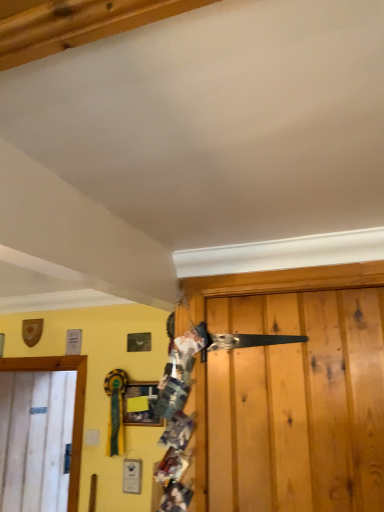
You are a GUI agent. You are given a task and a screenshot of the screen. Output one action in this format:
    pyautogui.click(x=<x>, y=<y>)
    Task: Click on the matte wooden picture frame at center
    The image size is (384, 512).
    Given the screenshot: What is the action you would take?
    pyautogui.click(x=140, y=408)

Measure the distance between point (78, 451) and camera.

Point (78, 451) and camera are 8.10 feet apart from each other.

Where is `white wood door at left`? This screenshot has height=512, width=384. white wood door at left is located at coordinates coord(75,405).

Locate an element on the screen. This screenshot has width=384, height=512. matte wooden picture frame at center is located at coordinates (140, 408).

Does white wood door at left contain multicolored fabric at center?

No, white wood door at left does not contain multicolored fabric at center.

Is white wood door at left oriented towards multicolored fabric at center?

Yes, white wood door at left is facing multicolored fabric at center.

Are white wood door at left and multicolored fabric at center making contact?

No, white wood door at left is not next to multicolored fabric at center.

Based on the photo, who is bigger, white wood door at left or multicolored fabric at center?

With larger size is white wood door at left.

Between multicolored fabric at center and white wood door at left, which one has larger width?

With larger width is multicolored fabric at center.

Considering the points (168, 477) and (71, 494), which point is in front, point (168, 477) or point (71, 494)?

The point (168, 477) is closer.

Considering their positions, is multicolored fabric at center located in front of or behind white wood door at left?

Visually, multicolored fabric at center is located in front of white wood door at left.

Considering the sizes of objects multicolored fabric at center and white wood door at left in the image provided, who is smaller, multicolored fabric at center or white wood door at left?

With smaller size is multicolored fabric at center.

Considering the sizes of objects multicolored fabric at center and matte wooden picture frame at center in the image provided, who is shorter, multicolored fabric at center or matte wooden picture frame at center?

matte wooden picture frame at center.

Is multicolored fabric at center spatially inside matte wooden picture frame at center, or outside of it?

multicolored fabric at center is not inside matte wooden picture frame at center, it's outside.

From the image's perspective, is multicolored fabric at center located beneath matte wooden picture frame at center?

No.

From the picture: Which of these two, multicolored fabric at center or matte wooden picture frame at center, is smaller?

With smaller size is matte wooden picture frame at center.

Which of these two, white wood door at left or matte wooden picture frame at center, is bigger?

white wood door at left.

Is white wood door at left oriented towards matte wooden picture frame at center?

Yes, white wood door at left is oriented towards matte wooden picture frame at center.

Is white wood door at left next to matte wooden picture frame at center?

No, white wood door at left is not in contact with matte wooden picture frame at center.

Is point (21, 364) closer or farther from the camera than point (127, 391)?

Clearly, point (21, 364) is more distant from the camera than point (127, 391).

Between matte wooden picture frame at center and white wood door at left, which one has smaller size?

Smaller between the two is matte wooden picture frame at center.

Identify the location of picture frame on the right of the white wood door at left. (140, 408).

From the image's perspective, who appears lower, matte wooden picture frame at center or white wood door at left?

white wood door at left, from the image's perspective.

From the picture: Is matte wooden picture frame at center turned away from multicolored fabric at center?

No, matte wooden picture frame at center's orientation is not away from multicolored fabric at center.

Is matte wooden picture frame at center outside of multicolored fabric at center?

Indeed, matte wooden picture frame at center is completely outside multicolored fabric at center.

Identify the location of picture frame lying below the multicolored fabric at center (from the image's perspective). (140, 408).

You are a GUI agent. You are given a task and a screenshot of the screen. Output one action in this format:
    pyautogui.click(x=<x>, y=<y>)
    Task: Click on the person above the white wood door at left (from a real-world perspective)
    This screenshot has height=512, width=384.
    Given the screenshot: What is the action you would take?
    pyautogui.click(x=177, y=414)

Where is `person that appears on the right of white wood door at left`? The width and height of the screenshot is (384, 512). person that appears on the right of white wood door at left is located at coordinates (177, 414).

From the image, which object appears to be farther from multicolored fabric at center, matte wooden picture frame at center or white wood door at left?

white wood door at left is further to multicolored fabric at center.

Which object lies further to the anchor point multicolored fabric at center, white wood door at left or matte wooden picture frame at center?

white wood door at left is positioned further to the anchor multicolored fabric at center.

When comparing their distances from matte wooden picture frame at center, does multicolored fabric at center or white wood door at left seem closer?

Among the two, white wood door at left is located nearer to matte wooden picture frame at center.

From the picture: Based on their spatial positions, is matte wooden picture frame at center or multicolored fabric at center closer to white wood door at left?

matte wooden picture frame at center is closer to white wood door at left.

When comparing their distances from white wood door at left, does multicolored fabric at center or matte wooden picture frame at center seem closer?

matte wooden picture frame at center is closer to white wood door at left.

Estimate the real-world distances between objects in this image. Which object is further from matte wooden picture frame at center, white wood door at left or multicolored fabric at center?

multicolored fabric at center is positioned further to the anchor matte wooden picture frame at center.

You are a GUI agent. You are given a task and a screenshot of the screen. Output one action in this format:
    pyautogui.click(x=<x>, y=<y>)
    Task: Click on the picture frame between multicolored fabric at center and white wood door at left from front to back
    The width and height of the screenshot is (384, 512).
    Given the screenshot: What is the action you would take?
    click(x=140, y=408)